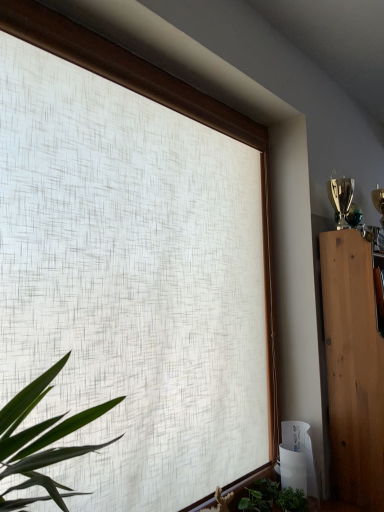
Where is `light brown wood cabinet at right`? This screenshot has height=512, width=384. light brown wood cabinet at right is located at coordinates (353, 369).

What do you see at coordinates (353, 369) in the screenshot? I see `light brown wood cabinet at right` at bounding box center [353, 369].

This screenshot has height=512, width=384. What do you see at coordinates (292, 500) in the screenshot? I see `green matte plant at lower right` at bounding box center [292, 500].

Identify the location of light brown wood cabinet at right. The height and width of the screenshot is (512, 384). (353, 369).

Can you confirm if light brown wood cabinet at right is taller than green matte plant at lower right?

Yes.

This screenshot has width=384, height=512. What are the coordinates of `plant in front of the light brown wood cabinet at right` in the screenshot? It's located at (292, 500).

Between light brown wood cabinet at right and green matte plant at lower right, which one has larger size?

With larger size is light brown wood cabinet at right.

Is light brown wood cabinet at right closer to camera compared to green matte plant at lower right?

No, light brown wood cabinet at right is further to the viewer.

Which of these two, light brown wood cabinet at right or green leafy plant at lower center, is smaller?

green leafy plant at lower center is smaller.

Is light brown wood cabinet at right oriented towards green leafy plant at lower center?

No, light brown wood cabinet at right is not facing towards green leafy plant at lower center.

Does light brown wood cabinet at right have a greater width compared to green leafy plant at lower center?

Indeed, light brown wood cabinet at right has a greater width compared to green leafy plant at lower center.

Measure the distance from light brown wood cabinet at right to green leafy plant at lower center.

light brown wood cabinet at right and green leafy plant at lower center are 18.97 inches apart.

How distant is green matte plant at lower right from light brown wood cabinet at right?

A distance of 19.92 inches exists between green matte plant at lower right and light brown wood cabinet at right.

Considering the points (304, 495) and (368, 324), which point is behind, point (304, 495) or point (368, 324)?

The point (368, 324) is more distant.

Consider the image. Can you confirm if green matte plant at lower right is thinner than light brown wood cabinet at right?

Yes.

Could you tell me if green matte plant at lower right is turned towards light brown wood cabinet at right?

No, green matte plant at lower right is not turned towards light brown wood cabinet at right.

In the scene shown: Is green leafy plant at lower center not within light brown wood cabinet at right?

green leafy plant at lower center is positioned outside light brown wood cabinet at right.

From a real-world perspective, is green leafy plant at lower center physically above light brown wood cabinet at right?

Incorrect, from a real-world perspective, green leafy plant at lower center is lower than light brown wood cabinet at right.

Which is in front, point (298, 501) or point (331, 289)?

Point (298, 501)

What's the angular difference between green leafy plant at lower center and light brown wood cabinet at right's facing directions?

1.49 degrees separate the facing orientations of green leafy plant at lower center and light brown wood cabinet at right.

Could you tell me if green matte plant at lower right is facing green leafy plant at lower center?

No.

In the scene shown: Can you tell me how much green matte plant at lower right and green leafy plant at lower center differ in facing direction?

There is a 0.000261-degree angle between the facing directions of green matte plant at lower right and green leafy plant at lower center.

Between green matte plant at lower right and green leafy plant at lower center, which one appears on the right side from the viewer's perspective?

green matte plant at lower right.

Is green matte plant at lower right next to green leafy plant at lower center?

Yes.

Which of these two, green leafy plant at lower center or green matte plant at lower right, is bigger?

Bigger between the two is green leafy plant at lower center.

From a real-world perspective, who is located lower, green leafy plant at lower center or green matte plant at lower right?

green leafy plant at lower center, from a real-world perspective.

Consider the image. Is green leafy plant at lower center oriented towards green matte plant at lower right?

Yes, green leafy plant at lower center is oriented towards green matte plant at lower right.

In order to click on plant below the light brown wood cabinet at right (from the image's perspective) in this screenshot , I will do `click(292, 500)`.

Where is `furniture positioned vertically above the green leafy plant at lower center (from a real-world perspective)`? This screenshot has height=512, width=384. furniture positioned vertically above the green leafy plant at lower center (from a real-world perspective) is located at coordinates (353, 369).

When comparing their distances from green matte plant at lower right, does green leafy plant at lower center or light brown wood cabinet at right seem closer?

green leafy plant at lower center lies closer to green matte plant at lower right than the other object.

Estimate the real-world distances between objects in this image. Which object is further from light brown wood cabinet at right, green leafy plant at lower center or green matte plant at lower right?

Based on the image, green matte plant at lower right appears to be further to light brown wood cabinet at right.

Considering their positions, is green matte plant at lower right positioned further to light brown wood cabinet at right than green leafy plant at lower center?

green matte plant at lower right lies further to light brown wood cabinet at right than the other object.

Based on their spatial positions, is light brown wood cabinet at right or green matte plant at lower right closer to green leafy plant at lower center?

green matte plant at lower right is closer to green leafy plant at lower center.

Considering their positions, is green matte plant at lower right positioned closer to green leafy plant at lower center than light brown wood cabinet at right?

green matte plant at lower right is closer to green leafy plant at lower center.

Considering their positions, is light brown wood cabinet at right positioned further to green matte plant at lower right than green leafy plant at lower center?

light brown wood cabinet at right.

At what (x,y) coordinates should I click in order to perform the action: click on plant between green leafy plant at lower center and light brown wood cabinet at right. Please return your answer as a coordinate pair (x, y). This screenshot has height=512, width=384. Looking at the image, I should click on (292, 500).